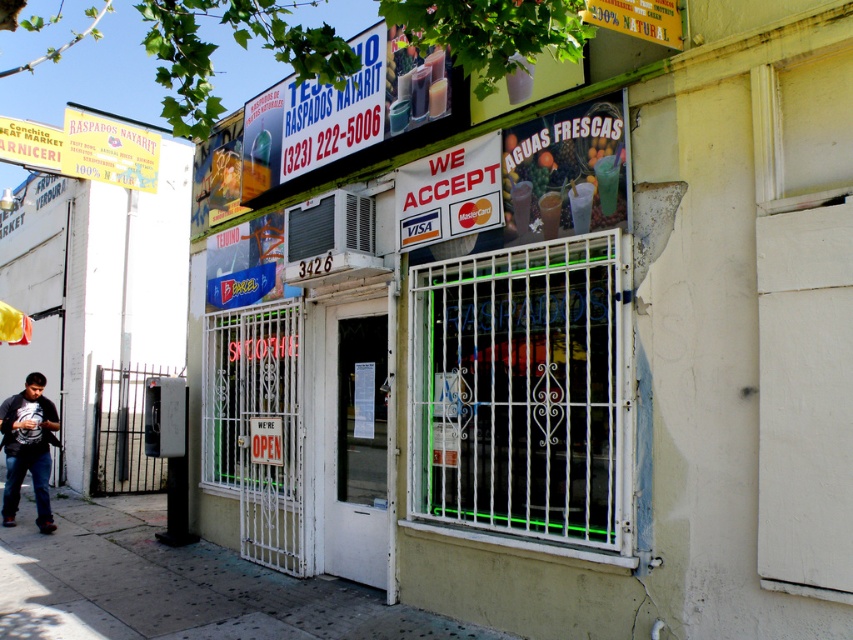
Does gray concrete sidewalk at lower left have a lesser height compared to dark gray cotton shirt at lower left?

Yes.

Does gray concrete sidewalk at lower left have a larger size compared to dark gray cotton shirt at lower left?

No, gray concrete sidewalk at lower left is not bigger than dark gray cotton shirt at lower left.

Locate an element on the screen. The width and height of the screenshot is (853, 640). gray concrete sidewalk at lower left is located at coordinates (177, 586).